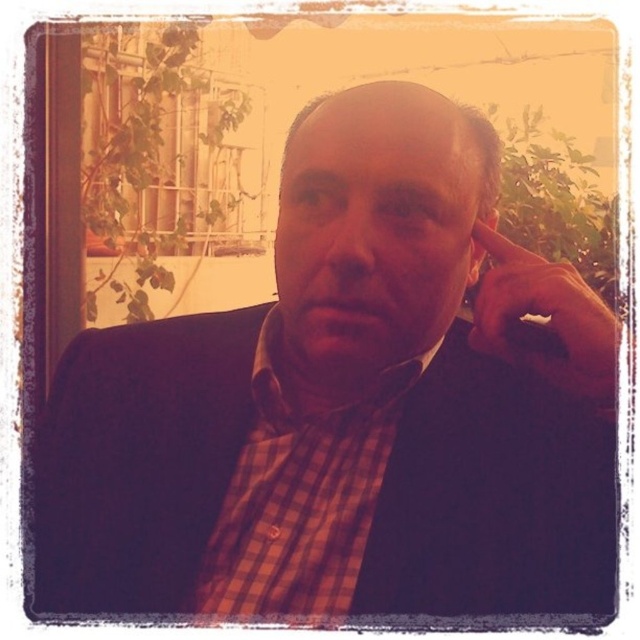
You are an assistant who needs to identify the exact location of the checkered fabric dress shirt in the image. The coordinates given are in the format of normalized coordinates between 0 and 1. Can you confirm if the checkered fabric dress shirt at center is located at point (300, 496)?

Yes, the checkered fabric dress shirt at center is located at point (300, 496) as stated in the coordinates.

You are standing in the scene and want to place a small decorative item between the two points, point (276, 531) and point (509, 310). Which point should the item be closer to in order to be in front of both?

The item should be closer to point (509, 310) since it is in front of point (276, 531).

You are an artist analyzing this scene. You notice the matte brown hand at upper right and the checkered fabric dress shirt at center. Which object is closer to the viewer?

The checkered fabric dress shirt at center is closer to the viewer because the matte brown hand at upper right is behind it.